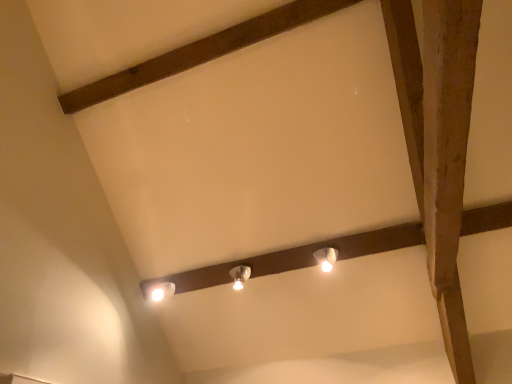
Question: From a real-world perspective, is white glossy lamp at upper center, marked as the second lamp in a back-to-front arrangement, over white glossy lamp at center, which is counted as the 1th lamp, starting from the left?

Choices:
 (A) no
 (B) yes

Answer: (A)

Question: Is white glossy lamp at upper center, which appears as the 1th lamp when viewed from the right, outside of white glossy lamp at center, which is counted as the 1th lamp, starting from the left?

Choices:
 (A) no
 (B) yes

Answer: (B)

Question: Can you confirm if white glossy lamp at upper center, the second lamp viewed from the left, is bigger than white glossy lamp at center, which appears as the 2th lamp when viewed from the right?

Choices:
 (A) yes
 (B) no

Answer: (B)

Question: Does white glossy lamp at upper center, marked as the second lamp in a back-to-front arrangement, lie behind white glossy lamp at center, which appears as the 2th lamp when viewed from the right?

Choices:
 (A) no
 (B) yes

Answer: (A)

Question: From the image's perspective, is white glossy lamp at upper center, which appears as the 1th lamp when viewed from the right, located beneath white glossy lamp at center, the 2th lamp viewed from the front?

Choices:
 (A) no
 (B) yes

Answer: (A)

Question: Considering the positions of white glossy lamp at upper center, which is the first lamp from front to back, and brown wooden plank at upper center in the image, is white glossy lamp at upper center, which is the first lamp from front to back, taller or shorter than brown wooden plank at upper center?

Choices:
 (A) short
 (B) tall

Answer: (B)

Question: Based on their positions, is white glossy lamp at upper center, which is the first lamp from front to back, located to the left or right of brown wooden plank at upper center?

Choices:
 (A) right
 (B) left

Answer: (A)

Question: Looking at the image, does white glossy lamp at upper center, which is the first lamp from front to back, seem bigger or smaller compared to brown wooden plank at upper center?

Choices:
 (A) small
 (B) big

Answer: (A)

Question: From a real-world perspective, is white glossy lamp at upper center, the second lamp viewed from the left, physically located above or below brown wooden plank at upper center?

Choices:
 (A) below
 (B) above

Answer: (A)

Question: Is white glossy lamp at upper center, marked as the second lamp in a back-to-front arrangement, in front of or behind white glossy lamp at center, which is counted as the 1th lamp, starting from the left, in the image?

Choices:
 (A) front
 (B) behind

Answer: (A)

Question: Is point (322, 258) positioned closer to the camera than point (236, 271)?

Choices:
 (A) farther
 (B) closer

Answer: (B)

Question: From the image's perspective, is white glossy lamp at upper center, the second lamp viewed from the left, above or below white glossy lamp at center, which is counted as the 1th lamp, starting from the left?

Choices:
 (A) above
 (B) below

Answer: (A)

Question: From their relative heights in the image, would you say white glossy lamp at upper center, marked as the second lamp in a back-to-front arrangement, is taller or shorter than white glossy lamp at center, which is counted as the 1th lamp, starting from the back?

Choices:
 (A) tall
 (B) short

Answer: (B)

Question: Considering their positions, is brown wooden plank at upper center located in front of or behind white glossy lamp at center, which appears as the 2th lamp when viewed from the right?

Choices:
 (A) behind
 (B) front

Answer: (B)

Question: Is brown wooden plank at upper center situated inside white glossy lamp at center, which appears as the 2th lamp when viewed from the right, or outside?

Choices:
 (A) outside
 (B) inside

Answer: (A)